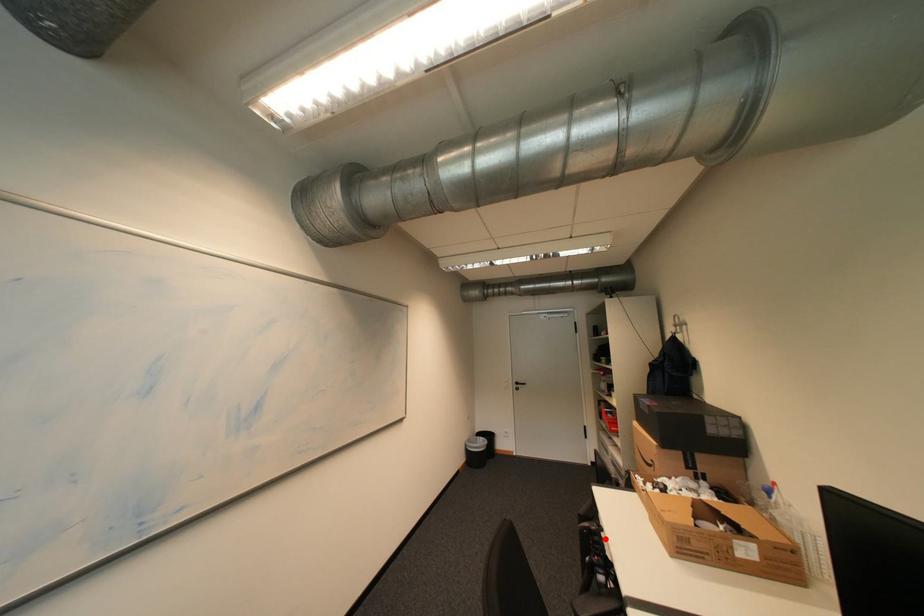
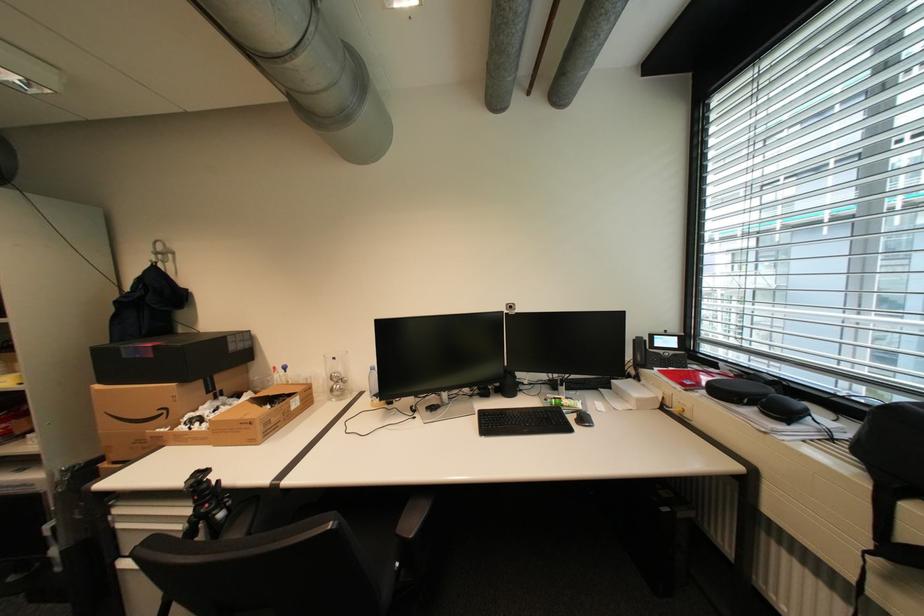
Where in the second image is the point corresponding to the highlighted location from the first image?

(213, 485)